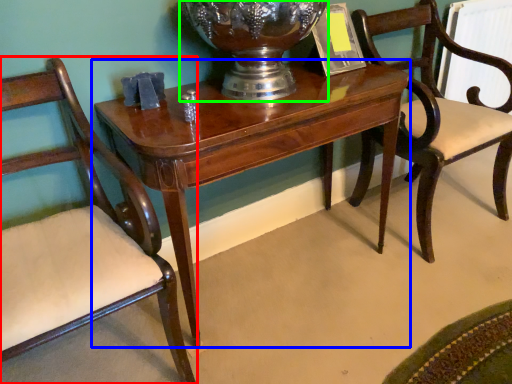
Question: Estimate the real-world distances between objects in this image. Which object is farther from chair (highlighted by a red box), table (highlighted by a blue box) or glass vase (highlighted by a green box)?

Choices:
 (A) table
 (B) glass vase

Answer: (B)